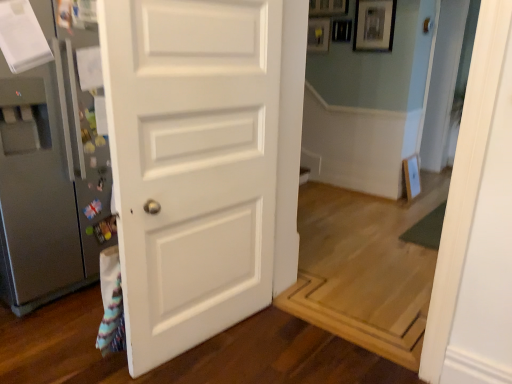
Question: From the image's perspective, is silver metallic door handle at center below matte black picture frame at upper center?

Choices:
 (A) yes
 (B) no

Answer: (A)

Question: From the image's perspective, would you say silver metallic door handle at center is positioned over matte black picture frame at upper center?

Choices:
 (A) no
 (B) yes

Answer: (A)

Question: From a real-world perspective, does silver metallic door handle at center stand above matte black picture frame at upper center?

Choices:
 (A) no
 (B) yes

Answer: (A)

Question: Does silver metallic door handle at center have a larger size compared to matte black picture frame at upper center?

Choices:
 (A) no
 (B) yes

Answer: (A)

Question: Is silver metallic door handle at center facing away from matte black picture frame at upper center?

Choices:
 (A) no
 (B) yes

Answer: (B)

Question: From a real-world perspective, relative to matte black picture frame at upper center, is satin silver refrigerator at left vertically above or below?

Choices:
 (A) below
 (B) above

Answer: (A)

Question: In terms of height, does satin silver refrigerator at left look taller or shorter compared to matte black picture frame at upper center?

Choices:
 (A) tall
 (B) short

Answer: (A)

Question: From the image's perspective, is satin silver refrigerator at left above or below matte black picture frame at upper center?

Choices:
 (A) below
 (B) above

Answer: (A)

Question: Is satin silver refrigerator at left situated inside matte black picture frame at upper center or outside?

Choices:
 (A) outside
 (B) inside

Answer: (A)

Question: Which is correct: matte black picture frame at upper center is inside silver metallic door handle at center, or outside of it?

Choices:
 (A) outside
 (B) inside

Answer: (A)

Question: Based on their sizes in the image, would you say matte black picture frame at upper center is bigger or smaller than silver metallic door handle at center?

Choices:
 (A) big
 (B) small

Answer: (A)

Question: From a real-world perspective, is matte black picture frame at upper center above or below silver metallic door handle at center?

Choices:
 (A) below
 (B) above

Answer: (B)

Question: Considering the relative positions of matte black picture frame at upper center and silver metallic door handle at center in the image provided, is matte black picture frame at upper center to the left or to the right of silver metallic door handle at center?

Choices:
 (A) left
 (B) right

Answer: (A)

Question: Is silver metallic door handle at center wider or thinner than transparent glass door at upper right?

Choices:
 (A) wide
 (B) thin

Answer: (B)

Question: In the image, is silver metallic door handle at center positioned in front of or behind transparent glass door at upper right?

Choices:
 (A) front
 (B) behind

Answer: (A)